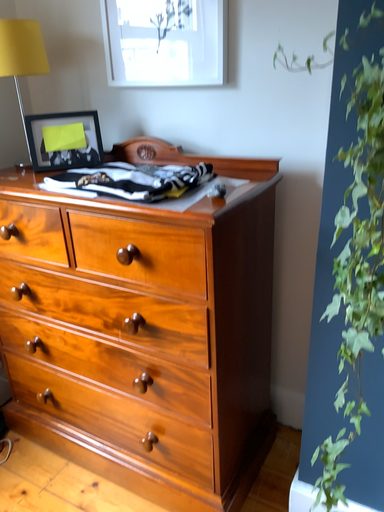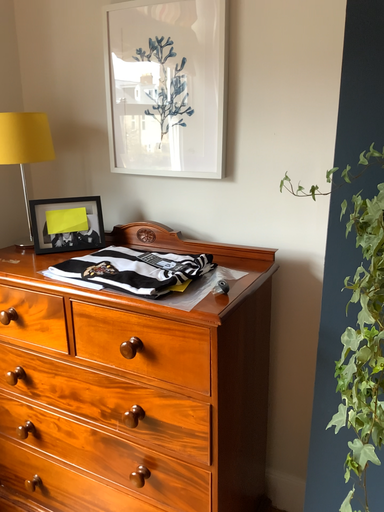
Question: Which way did the camera rotate in the video?

Choices:
 (A) rotated downward
 (B) rotated upward

Answer: (B)